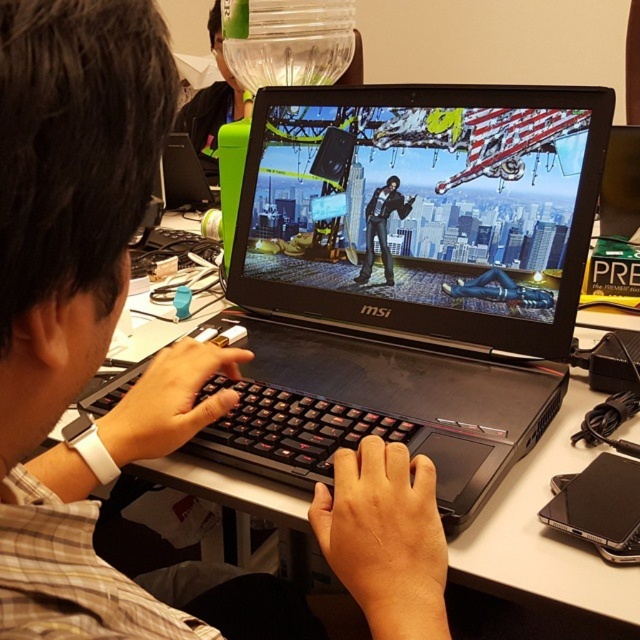
Question: Which object is farther from the camera taking this photo?

Choices:
 (A) shiny black laptop at center
 (B) white plastic table at center
 (C) green plastic water bottle at upper center
 (D) black matte jacket at center

Answer: (C)

Question: Which of the following is the farthest from the observer?

Choices:
 (A) shiny black laptop at center
 (B) green plastic water bottle at upper center
 (C) black matte keyboard at center
 (D) white plastic table at center

Answer: (B)

Question: Which object is farther from the camera taking this photo?

Choices:
 (A) green plastic water bottle at upper center
 (B) white plastic table at center

Answer: (A)

Question: Does black matte keyboard at center have a larger size compared to shiny black laptop at center?

Choices:
 (A) no
 (B) yes

Answer: (B)

Question: Does shiny black laptop at center have a larger size compared to white plastic table at center?

Choices:
 (A) no
 (B) yes

Answer: (A)

Question: Does black matte keyboard at center lie in front of white plastic table at center?

Choices:
 (A) yes
 (B) no

Answer: (A)